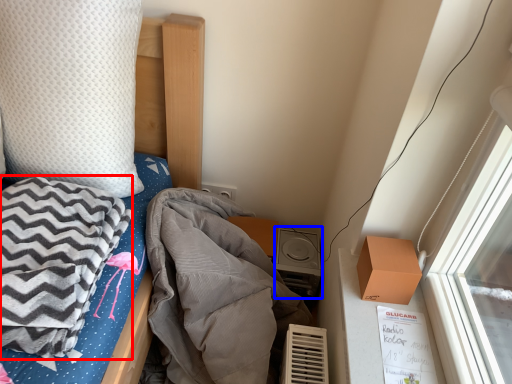
Question: Among these objects, which one is farthest to the camera, blanket (highlighted by a red box) or stereo (highlighted by a blue box)?

Choices:
 (A) blanket
 (B) stereo

Answer: (B)